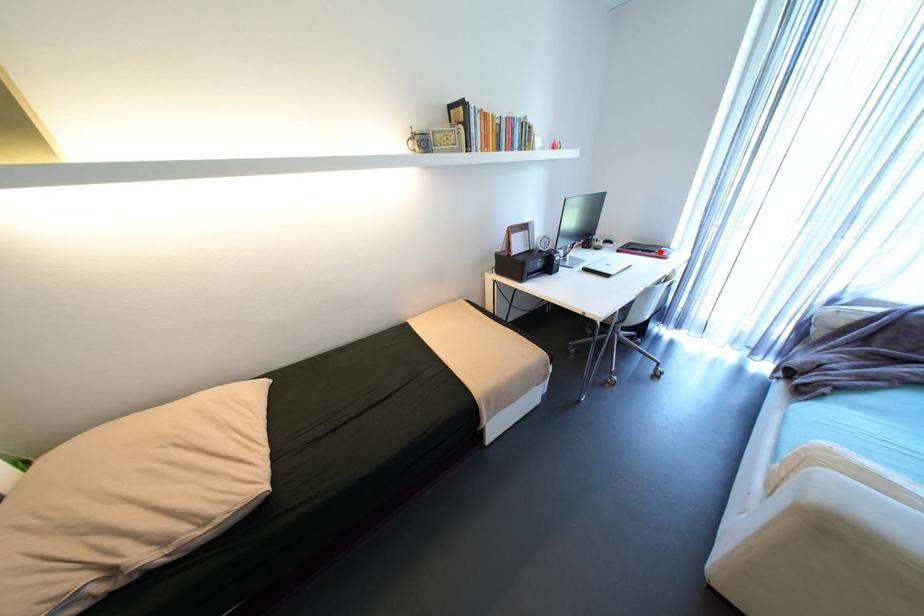
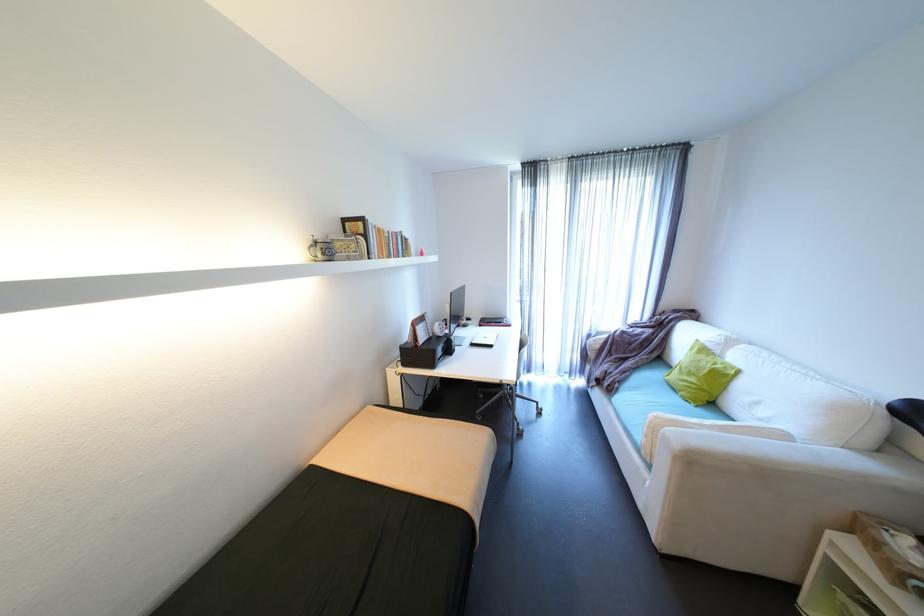
Where in the second image is the point corresponding to the highlighted location from the first image?

(508, 323)